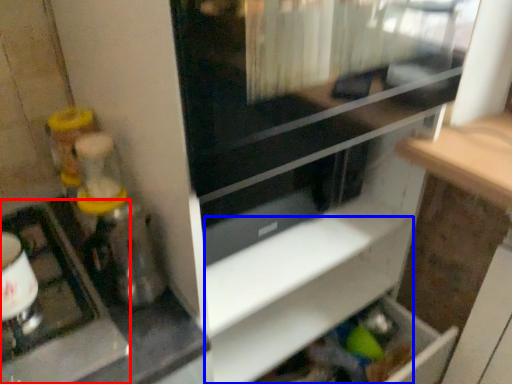
Question: Among these objects, which one is nearest to the camera, appliance (highlighted by a red box) or shelf (highlighted by a blue box)?

Choices:
 (A) appliance
 (B) shelf

Answer: (A)